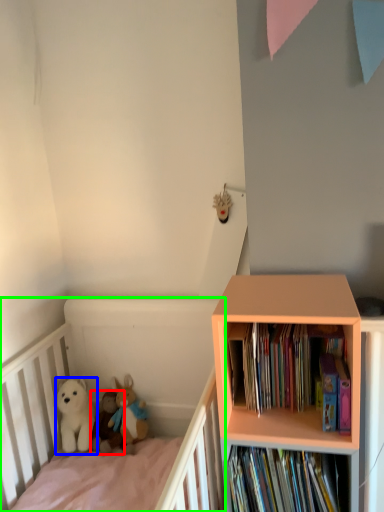
Question: Which object is positioned farthest from toy (highlighted by a red box)? Select from dog (highlighted by a blue box) and infant bed (highlighted by a green box).

Choices:
 (A) dog
 (B) infant bed

Answer: (B)